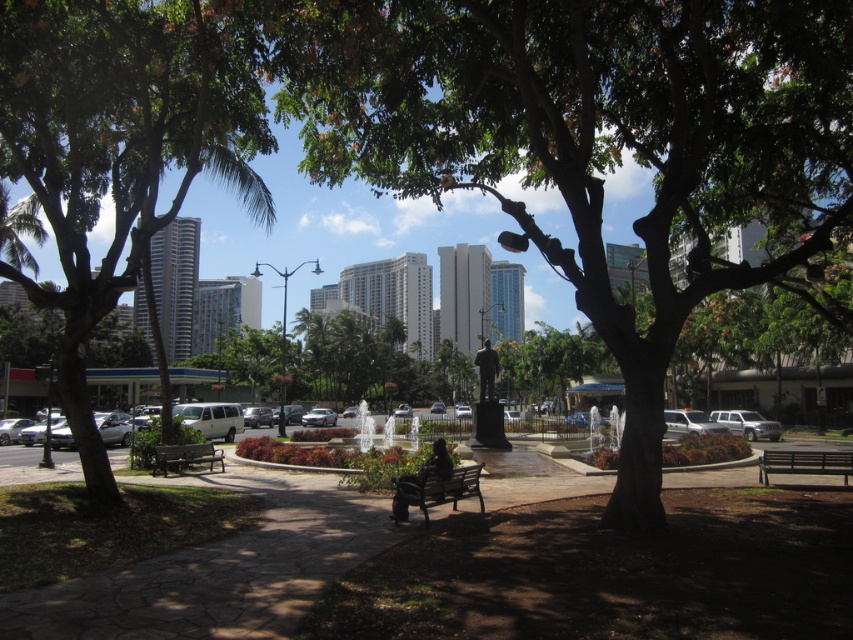
You are a park visitor standing on the paved pathway. You want to take a photo of the dark brown textured tree at center without the green leafy tree at left blocking the view. Is this possible?

The dark brown textured tree at center is positioned under the green leafy tree at left, so taking a photo without the green leafy tree at left blocking the view would not be possible as it is directly above it.

You are a visitor to the park and want to sit on the wooden park bench at lower right. From your current position, which side of the green leafy tree at left should you walk around to reach the bench?

You should walk around the right side of the green leafy tree at left to reach the wooden park bench at lower right since the bench is positioned to the right of the tree.

Looking at this image, you are standing at the statue in the center of the fountain and want to walk to the parking area. There are two points marked on the ground in front of you. One is at point (494, 26) and the other is at point (183, 458). Which point should you step on first if you want to reach the parking area as quickly as possible?

You should step on point (494, 26) first because it is closer to you than point (183, 458), so reaching it first would be quicker on your way to the parking area.